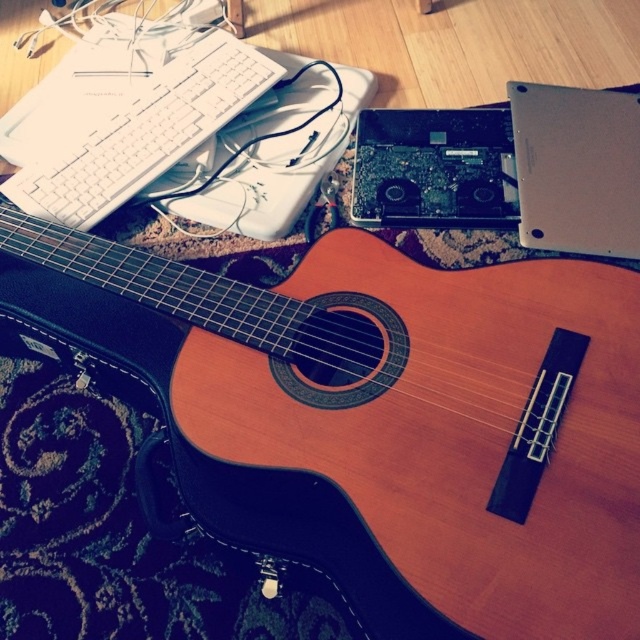
Does natural wood acoustic guitar at center have a lesser height compared to silver metallic laptop at upper right?

No, natural wood acoustic guitar at center is not shorter than silver metallic laptop at upper right.

What do you see at coordinates (384, 419) in the screenshot? The height and width of the screenshot is (640, 640). I see `natural wood acoustic guitar at center` at bounding box center [384, 419].

Is point (400, 273) farther from viewer compared to point (515, 97)?

That is False.

Locate an element on the screen. natural wood acoustic guitar at center is located at coordinates (384, 419).

Who is positioned more to the right, natural wood acoustic guitar at center or white plastic keyboard at upper left?

From the viewer's perspective, natural wood acoustic guitar at center appears more on the right side.

What do you see at coordinates (384, 419) in the screenshot? I see `natural wood acoustic guitar at center` at bounding box center [384, 419].

In order to click on natural wood acoustic guitar at center in this screenshot , I will do `click(384, 419)`.

In the scene shown: Which is more to the right, white plastic keyboard at upper left or black plastic laptop at upper center?

Positioned to the right is black plastic laptop at upper center.

Which is behind, point (108, 172) or point (419, 140)?

Point (419, 140)

The width and height of the screenshot is (640, 640). I want to click on white plastic keyboard at upper left, so click(x=145, y=132).